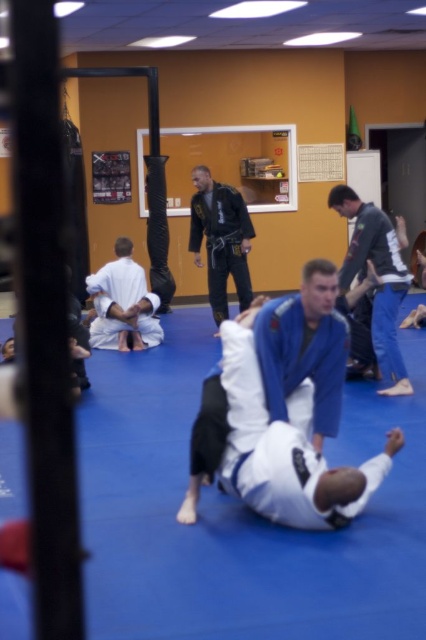
Who is positioned more to the left, blue matte kimono at center or white matte kimono at center?

white matte kimono at center

Between point (319, 426) and point (120, 282), which one is positioned in front?

Point (319, 426) is in front.

Identify the location of blue matte kimono at center. Image resolution: width=426 pixels, height=640 pixels. (302, 348).

Is blue matte kimono at center taller than black matte gi at center?

Incorrect, blue matte kimono at center's height is not larger of black matte gi at center's.

The height and width of the screenshot is (640, 426). What do you see at coordinates (302, 348) in the screenshot? I see `blue matte kimono at center` at bounding box center [302, 348].

You are a GUI agent. You are given a task and a screenshot of the screen. Output one action in this format:
    pyautogui.click(x=<x>, y=<y>)
    Task: Click on the blue matte kimono at center
    
    Given the screenshot: What is the action you would take?
    pyautogui.click(x=302, y=348)

Is black matte gi at center taller than white matte kimono at center?

A: Yes.

Who is more distant from viewer, (221, 262) or (86, 282)?

Positioned behind is point (86, 282).

This screenshot has width=426, height=640. Identify the location of black matte gi at center. (221, 240).